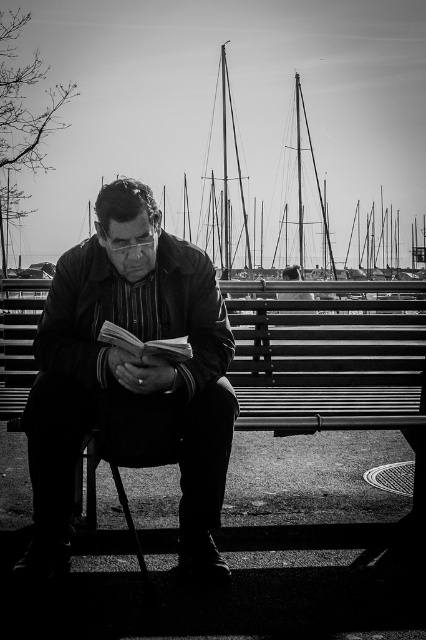
Question: Among these points, which one is nearest to the camera?

Choices:
 (A) (184, 342)
 (B) (172, 273)

Answer: (A)

Question: Is the position of matte black jacket at center less distant than that of thick paper book at center?

Choices:
 (A) yes
 (B) no

Answer: (B)

Question: Can you confirm if matte black jacket at center is bigger than thick paper book at center?

Choices:
 (A) yes
 (B) no

Answer: (A)

Question: Can you confirm if matte black jacket at center is positioned to the right of thick paper book at center?

Choices:
 (A) yes
 (B) no

Answer: (B)